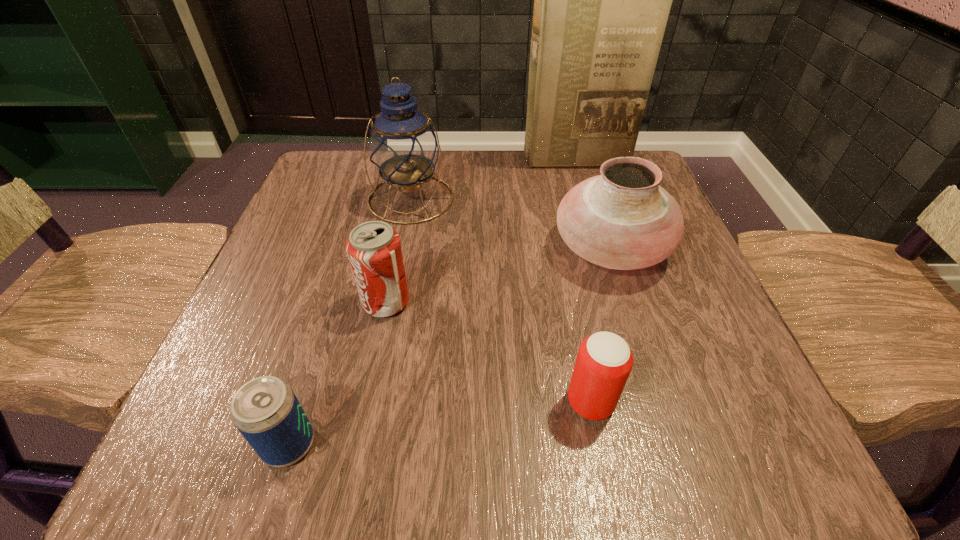
The image size is (960, 540). What are the coordinates of `blank space that satisfies the following two spatial constraints: 1. on the front-facing side of the pottery; 2. on the right side of the fifth shortest object` in the screenshot? It's located at (401, 247).